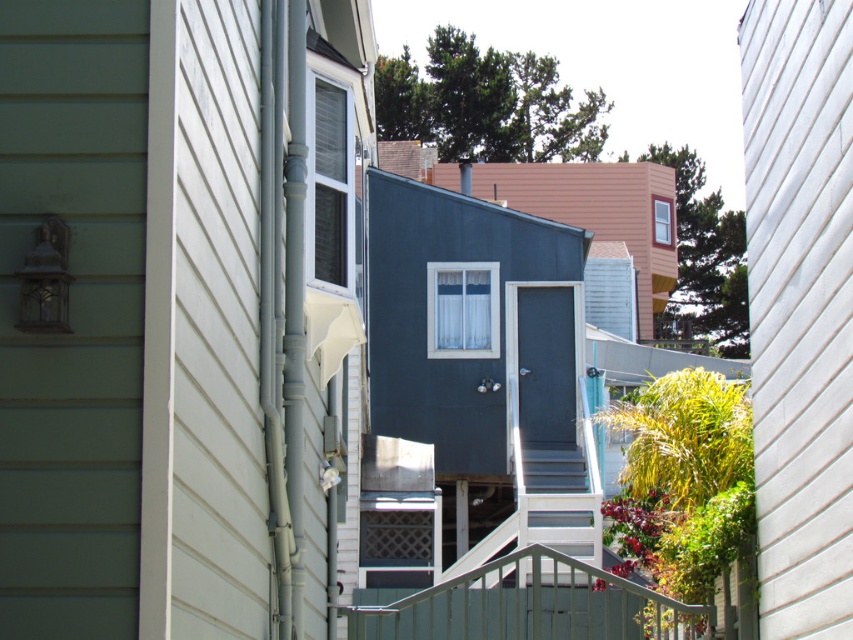
From the picture: You are standing in the alleyway between the two buildings and want to reach a specific point marked at coordinates point (491,308). If your walking speed is 1.5 meters per second, how many seconds will it take you to reach that point?

The point (491,308) is 26.62 meters from the camera. At a speed of 1.5 meters per second, it would take approximately 17.75 seconds to reach the point.

You are standing at the bottom of the stairs in the alleyway and want to look up at the white plastic window at center and the white matte shutter at upper center. Which one is positioned to the left when viewed from your perspective?

The white plastic window at center is positioned to the left of the white matte shutter at upper center from your perspective.